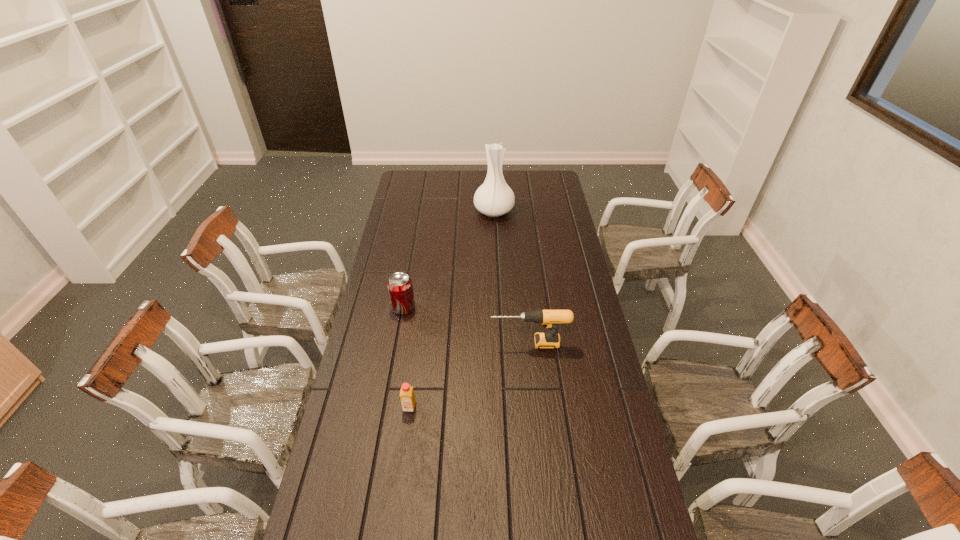
Locate an element on the screen. vase is located at coordinates (494, 198).

Find the location of a particular element. The height and width of the screenshot is (540, 960). the farthest object is located at coordinates (494, 198).

At what (x,y) coordinates should I click in order to perform the action: click on the third farthest object. Please return your answer as a coordinate pair (x, y). This screenshot has height=540, width=960. Looking at the image, I should click on (549, 318).

Where is `soda can`? soda can is located at coordinates (400, 288).

At what (x,y) coordinates should I click in order to perform the action: click on the leftmost object. Please return your answer as a coordinate pair (x, y). This screenshot has height=540, width=960. Looking at the image, I should click on (400, 288).

Image resolution: width=960 pixels, height=540 pixels. Identify the location of the second object from left to right. (407, 397).

At what (x,y) coordinates should I click in order to perform the action: click on the shortest object. Please return your answer as a coordinate pair (x, y). Image resolution: width=960 pixels, height=540 pixels. Looking at the image, I should click on (407, 397).

What are the coordinates of `blank space located on the left of the vase` in the screenshot? It's located at (444, 211).

Identify the location of vacant space situated 0.150m on the handle side of the drill. (449, 343).

Find the location of a particular element. blank area located 0.060m on the handle side of the drill is located at coordinates (474, 343).